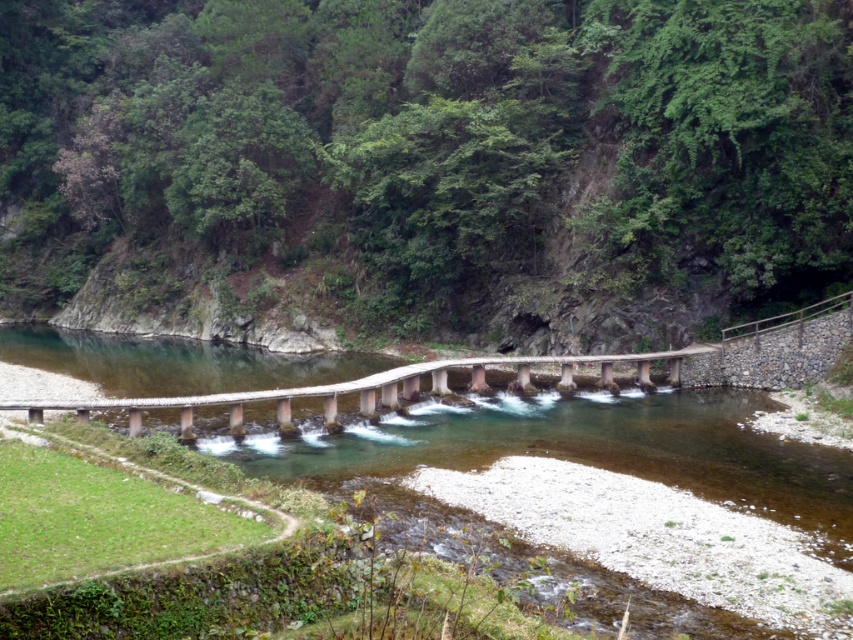
Is green leafy hillside at upper center behind wooden bridge at center?

That is True.

Does green leafy hillside at upper center have a larger size compared to wooden bridge at center?

Correct, green leafy hillside at upper center is larger in size than wooden bridge at center.

Is point (671, 84) positioned before point (650, 353)?

No, it is behind (650, 353).

Where is `green leafy hillside at upper center`? green leafy hillside at upper center is located at coordinates (426, 163).